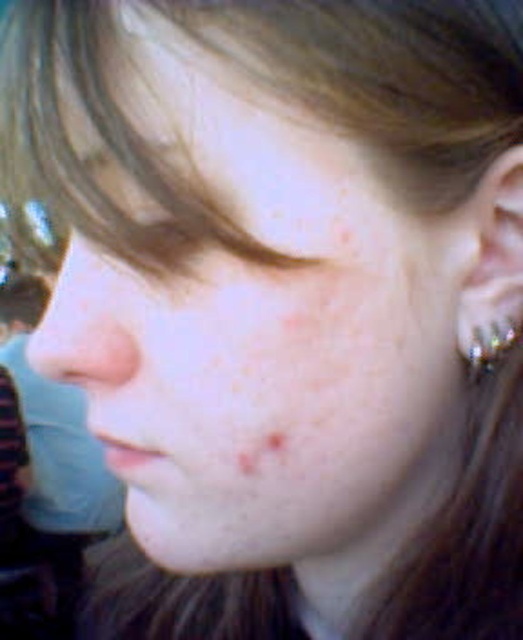
You are a GUI agent. You are given a task and a screenshot of the screen. Output one action in this format:
    pyautogui.click(x=<x>, y=<y>)
    Task: Click on the silver metallic earring at right
    The width and height of the screenshot is (523, 640).
    Given the screenshot: What is the action you would take?
    pyautogui.click(x=492, y=340)

I want to click on silver metallic earring at right, so click(x=492, y=340).

The width and height of the screenshot is (523, 640). What do you see at coordinates (83, 344) in the screenshot? I see `matte skin nose at center` at bounding box center [83, 344].

Does matte skin nose at center appear on the left side of silver metallic earring at right?

Indeed, matte skin nose at center is positioned on the left side of silver metallic earring at right.

Does point (51, 337) lie in front of point (518, 321)?

That is True.

The height and width of the screenshot is (640, 523). Identify the location of matte skin nose at center. (83, 344).

Looking at this image, which is more to the right, matte skin nose at center or brown matte freckle at lower center?

From the viewer's perspective, brown matte freckle at lower center appears more on the right side.

Between point (106, 372) and point (253, 444), which one is positioned behind?

Point (253, 444)

Where is `matte skin nose at center`? matte skin nose at center is located at coordinates (83, 344).